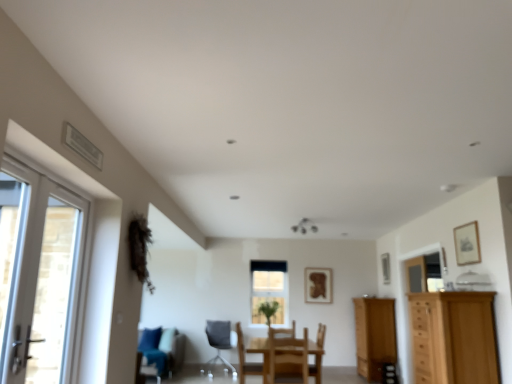
Question: In the image, is clear glass window at center on the left side or the right side of green leafy plant at center?

Choices:
 (A) left
 (B) right

Answer: (B)

Question: Considering the positions of clear glass window at center and green leafy plant at center in the image, is clear glass window at center taller or shorter than green leafy plant at center?

Choices:
 (A) tall
 (B) short

Answer: (A)

Question: Which object is positioned farthest from the matte gold picture frame at upper right, the third picture frame from the back?

Choices:
 (A) wooden chair at center, which is the 2th chair from front to back
 (B) teal fabric swivel chair at lower left
 (C) wooden chair at center, arranged as the first chair when viewed from the right
 (D) gray fabric chair at center, the first chair viewed from the left
 (E) wooden framed picture at center, the 3th picture frame viewed from the right

Answer: (B)

Question: Which object is positioned farthest from the matte gold picture frame at upper right, the third picture frame in the bottom-to-top sequence?

Choices:
 (A) wooden chair at center, the 3th chair in the back-to-front sequence
 (B) green leafy plant at center
 (C) wooden chair at center, the second chair when ordered from left to right
 (D) wooden cabinet at right, placed as the second door when sorted from left to right
 (E) teal fabric swivel chair at lower left

Answer: (E)